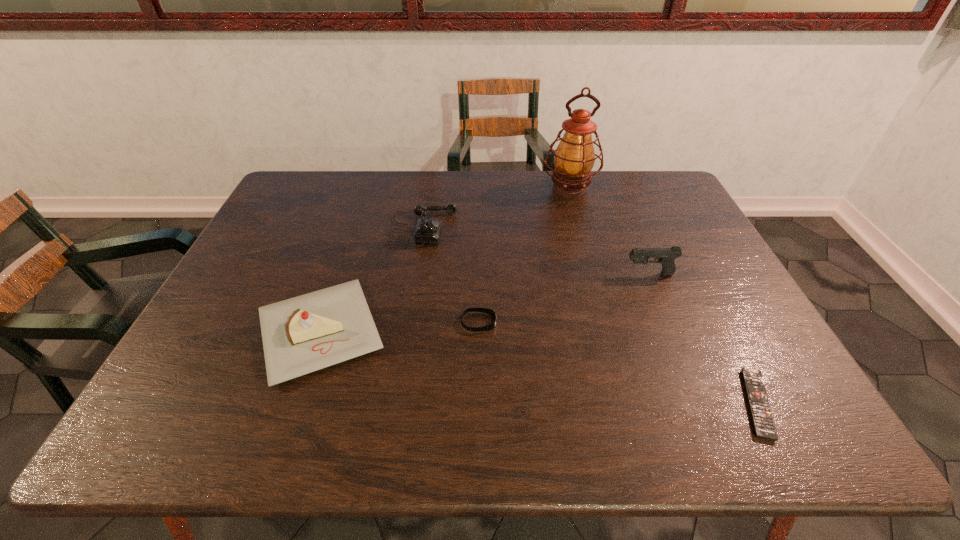
Find the location of a particular element. The width and height of the screenshot is (960, 540). free location that satisfies the following two spatial constraints: 1. on the front side of the tallest object; 2. on the display of the wristband is located at coordinates (607, 322).

Where is `free space that satisfies the following two spatial constraints: 1. at the barrel of the fourth nearest object; 2. on the front side of the cake`? The image size is (960, 540). free space that satisfies the following two spatial constraints: 1. at the barrel of the fourth nearest object; 2. on the front side of the cake is located at coordinates (673, 332).

Where is `free space that satisfies the following two spatial constraints: 1. on the dial of the second farthest object; 2. on the front side of the cake`? The height and width of the screenshot is (540, 960). free space that satisfies the following two spatial constraints: 1. on the dial of the second farthest object; 2. on the front side of the cake is located at coordinates [x=405, y=332].

Locate an element on the screen. free space that satisfies the following two spatial constraints: 1. on the front side of the tallest object; 2. on the dial of the telephone is located at coordinates (581, 228).